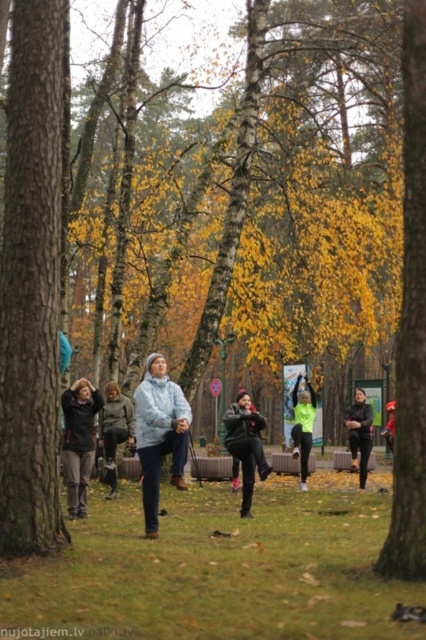
Can you confirm if brown rough tree trunk at left is taller than black matte jacket at center?

Indeed, brown rough tree trunk at left has a greater height compared to black matte jacket at center.

The height and width of the screenshot is (640, 426). Describe the element at coordinates (31, 284) in the screenshot. I see `brown rough tree trunk at left` at that location.

Identify the location of brown rough tree trunk at left. (31, 284).

Does matte gray jacket at center appear under dark gray sweater at center?

Actually, matte gray jacket at center is above dark gray sweater at center.

Who is more forward, (143, 433) or (121, 426)?

Positioned in front is point (143, 433).

Where is `matte gray jacket at center`? This screenshot has height=640, width=426. matte gray jacket at center is located at coordinates pos(160,435).

Can you confirm if yellow leafy tree at right is positioned to the left of neon green fabric at center?

Yes, yellow leafy tree at right is to the left of neon green fabric at center.

Between point (405, 129) and point (302, 394), which one is positioned in front?

Point (405, 129) is in front.

Image resolution: width=426 pixels, height=640 pixels. I want to click on yellow leafy tree at right, so click(411, 323).